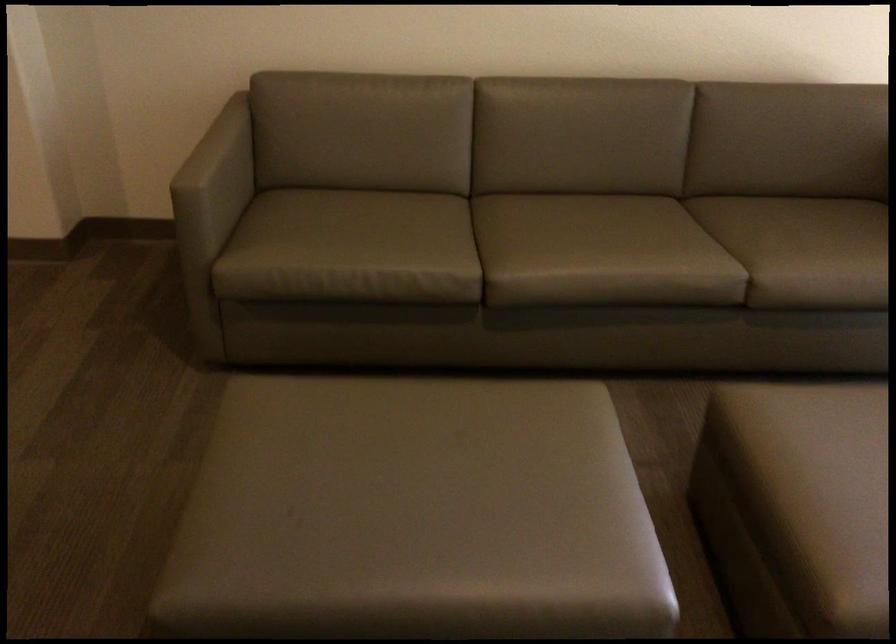
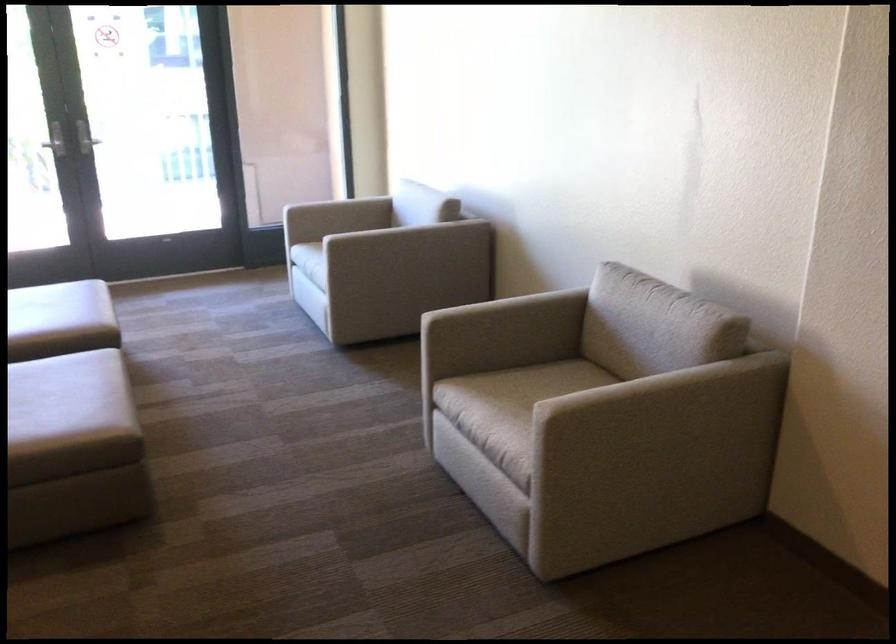
In the second image, find the point that corresponds to (x=485, y=556) in the first image.

(65, 384)